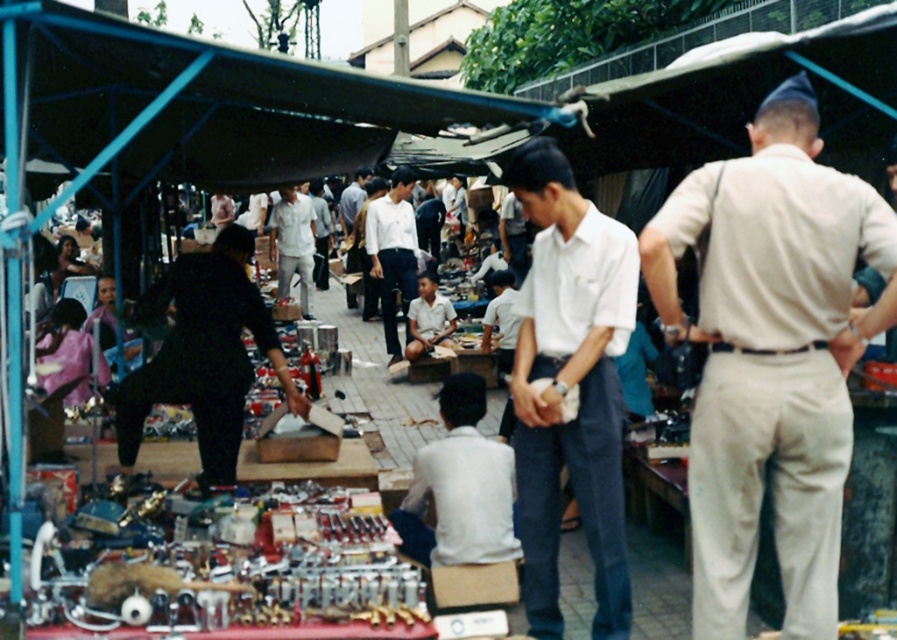
Question: Which object appears farthest from the camera in this image?

Choices:
 (A) white smooth shirt at center
 (B) white cotton shirt at center

Answer: (A)

Question: Can you confirm if white cotton shirt at center is positioned above black matte street vendor at left?

Choices:
 (A) no
 (B) yes

Answer: (A)

Question: Estimate the real-world distances between objects in this image. Which object is closer to the white cotton shirt at center?

Choices:
 (A) beige cotton shirt at center
 (B) white smooth shirt at center

Answer: (A)

Question: Which point is closer to the camera?

Choices:
 (A) tap(555, 468)
 (B) tap(694, 435)

Answer: (B)

Question: From the image, what is the correct spatial relationship of beige cotton shirt at center in relation to white smooth shirt at center?

Choices:
 (A) right
 (B) left

Answer: (A)

Question: Does white cotton shirt at center lie behind black matte street vendor at left?

Choices:
 (A) yes
 (B) no

Answer: (B)